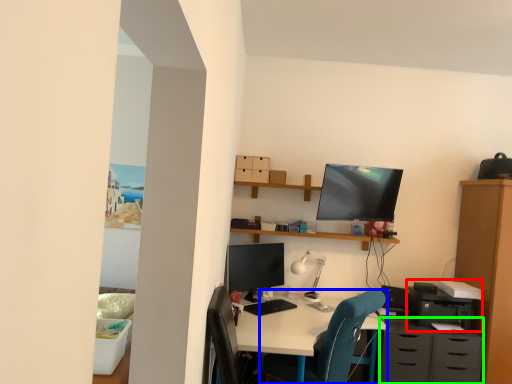
Question: Which object is positioned closest to printer (highlighted by a red box)? Select from chair (highlighted by a blue box) and dresser (highlighted by a green box).

Choices:
 (A) chair
 (B) dresser

Answer: (B)